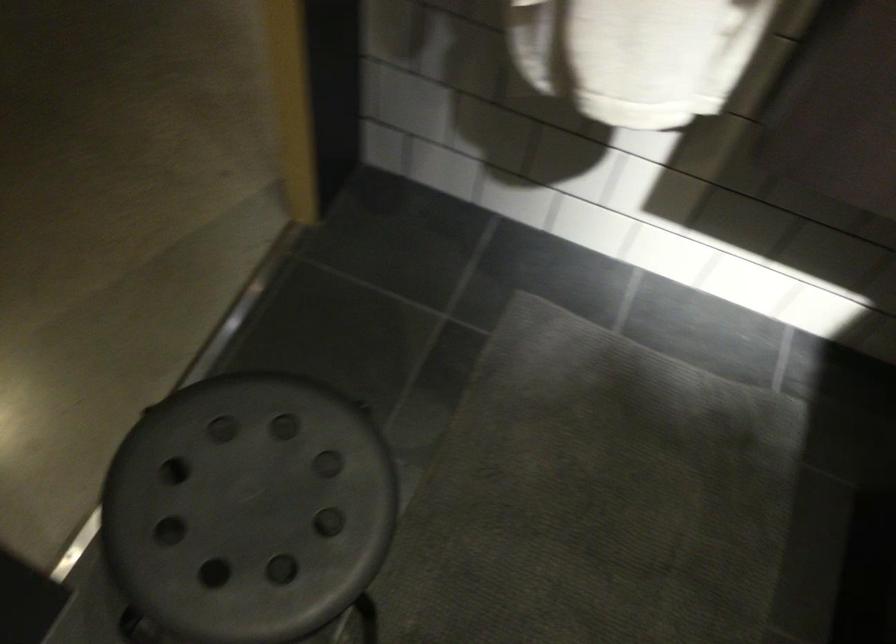
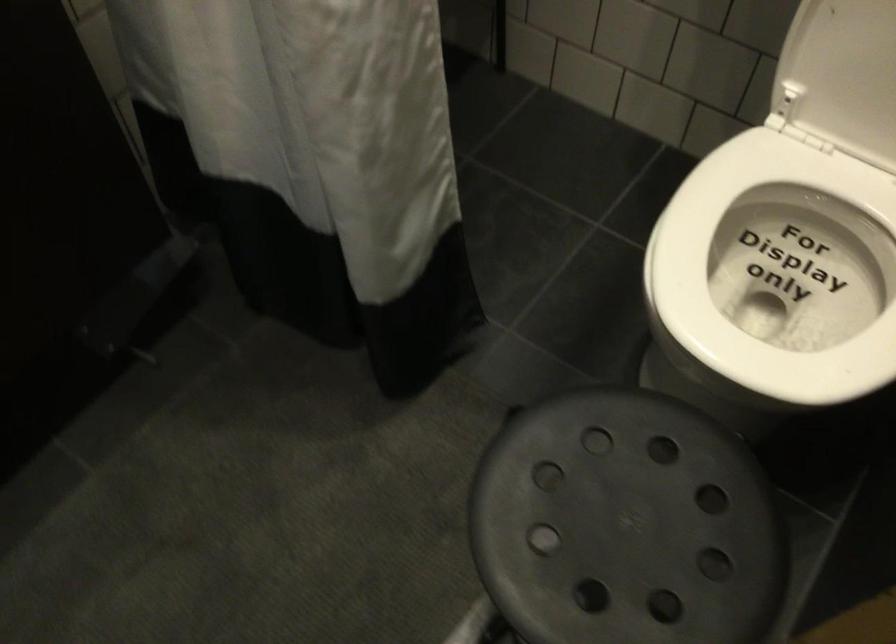
Locate, in the second image, the point that corresponds to point 214,483 in the first image.

(625, 525)